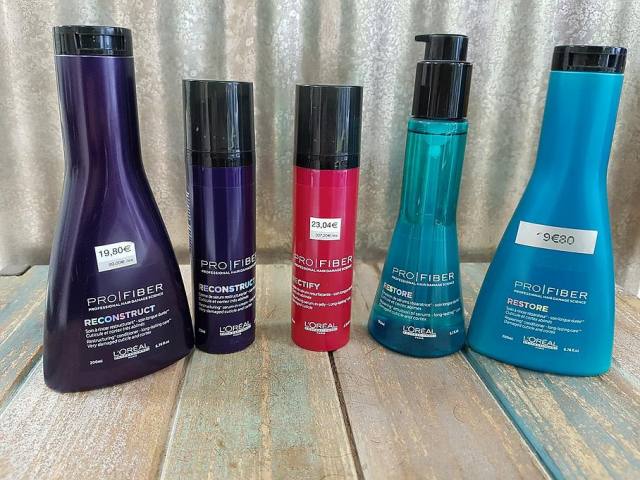
Where is `medium purple container with black top`? This screenshot has width=640, height=480. medium purple container with black top is located at coordinates tap(217, 117), tap(207, 186), tap(195, 338), tap(248, 331), tap(248, 200).